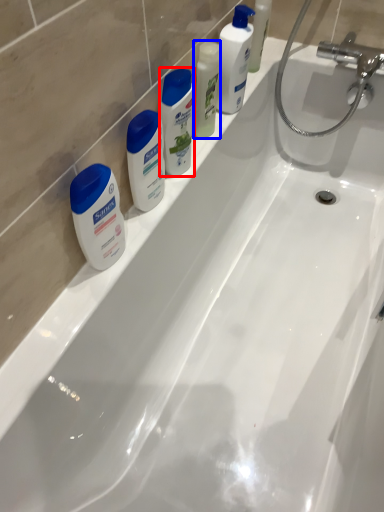
Question: Which point is further to the camera, cleaning product (highlighted by a red box) or cleaning product (highlighted by a blue box)?

Choices:
 (A) cleaning product
 (B) cleaning product

Answer: (B)